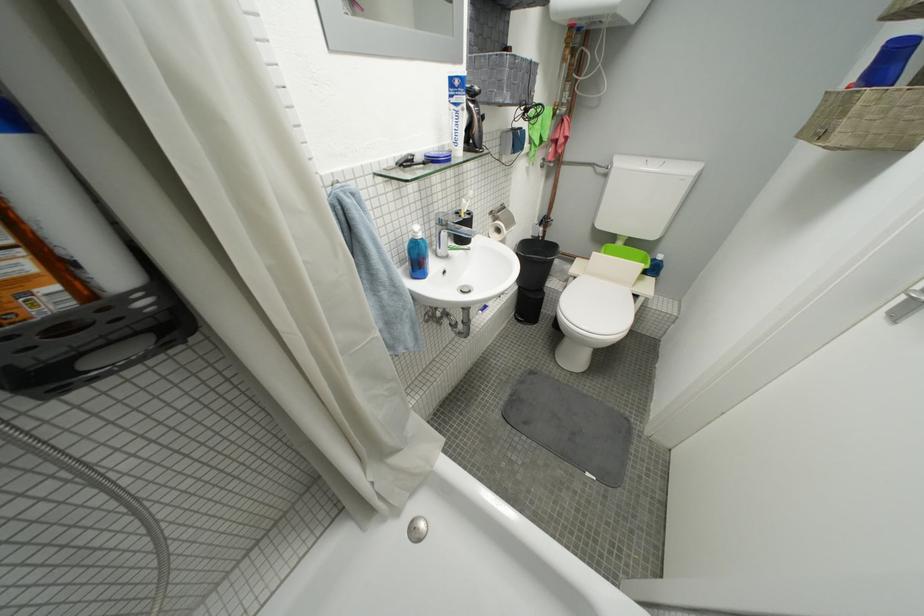
Find where to pull the silver door handle. Please return your answer as a coordinate pair (x, y).

(913, 296)